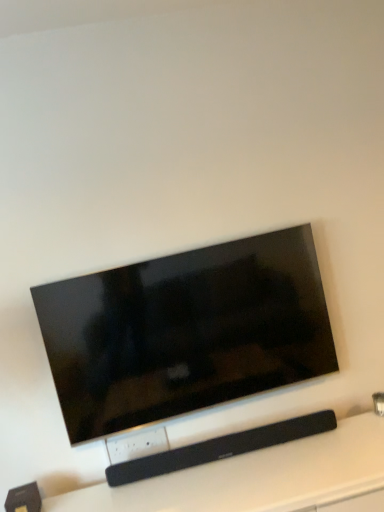
Question: Considering the positions of point (190, 289) and point (119, 508), is point (190, 289) closer or farther from the camera than point (119, 508)?

Choices:
 (A) closer
 (B) farther

Answer: (B)

Question: In the image, is matte black tv at center on the left side or the right side of black matte soundbar at center?

Choices:
 (A) right
 (B) left

Answer: (B)

Question: Considering the positions of matte black tv at center and black matte soundbar at center in the image, is matte black tv at center wider or thinner than black matte soundbar at center?

Choices:
 (A) thin
 (B) wide

Answer: (A)

Question: From their relative heights in the image, would you say black matte soundbar at center is taller or shorter than matte black tv at center?

Choices:
 (A) short
 (B) tall

Answer: (A)

Question: From a real-world perspective, is black matte soundbar at center above or below matte black tv at center?

Choices:
 (A) below
 (B) above

Answer: (A)

Question: From the image's perspective, is black matte soundbar at center positioned above or below matte black tv at center?

Choices:
 (A) above
 (B) below

Answer: (B)

Question: Is point (97, 490) closer or farther from the camera than point (162, 344)?

Choices:
 (A) closer
 (B) farther

Answer: (A)